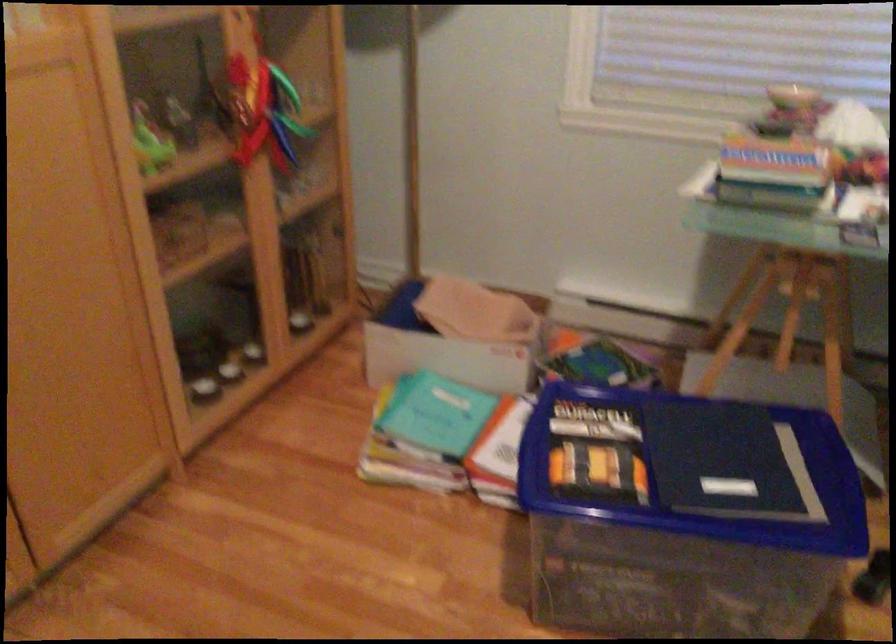
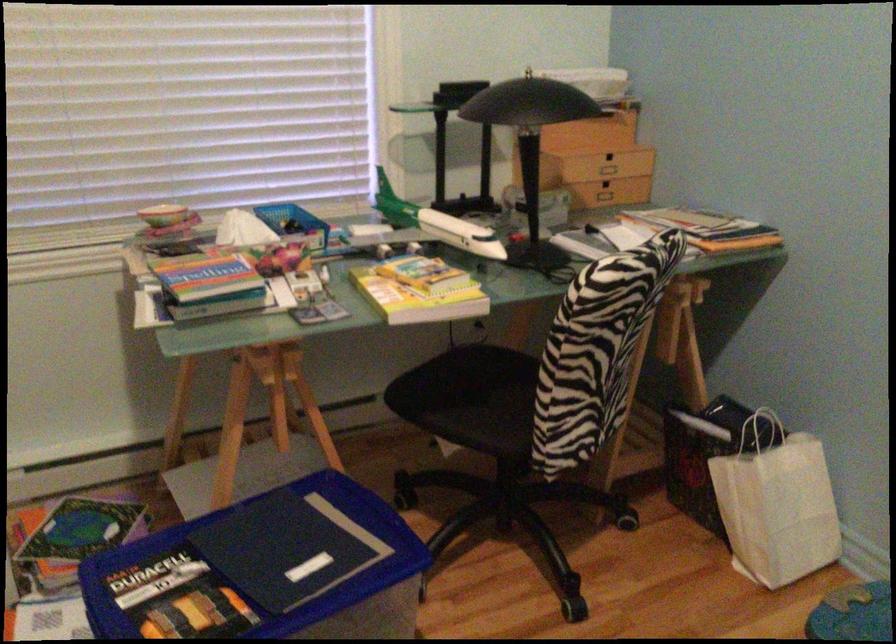
In the second image, find the point that corresponds to [752,480] in the first image.

(316, 551)